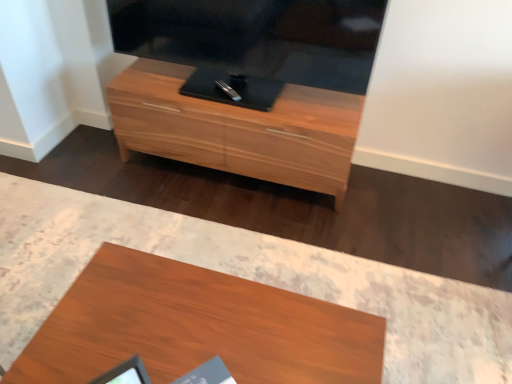
This screenshot has width=512, height=384. What are the coordinates of `empty space that is ontop of wooden desk at center (from a real-world perspective)` in the screenshot? It's located at (192, 322).